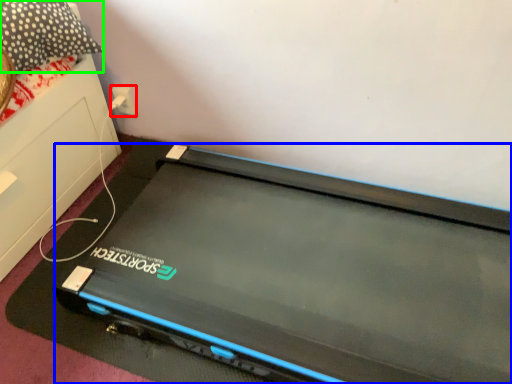
Question: Considering the real-world distances, which object is closest to electric outlet (highlighted by a red box)? computer (highlighted by a blue box) or pillow (highlighted by a green box).

Choices:
 (A) computer
 (B) pillow

Answer: (B)